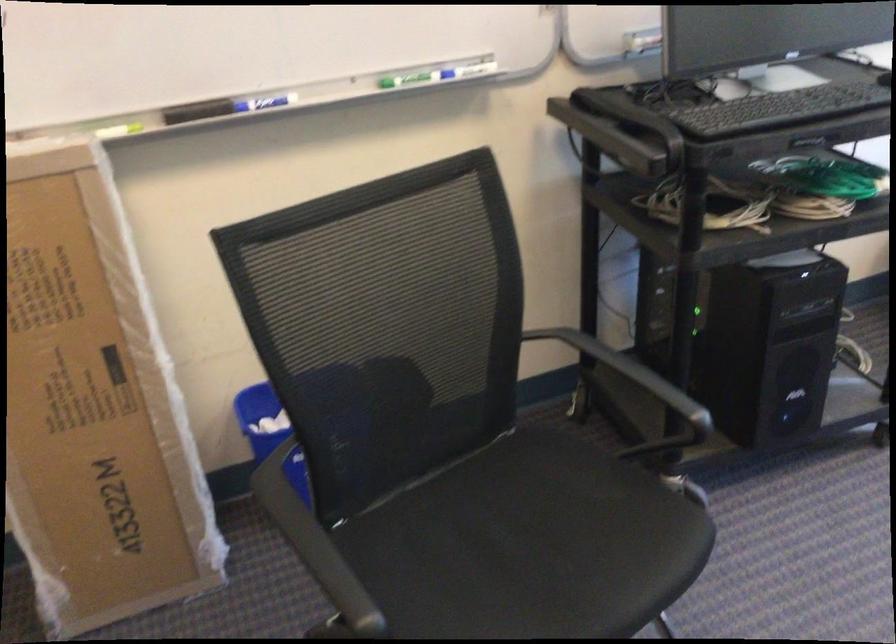
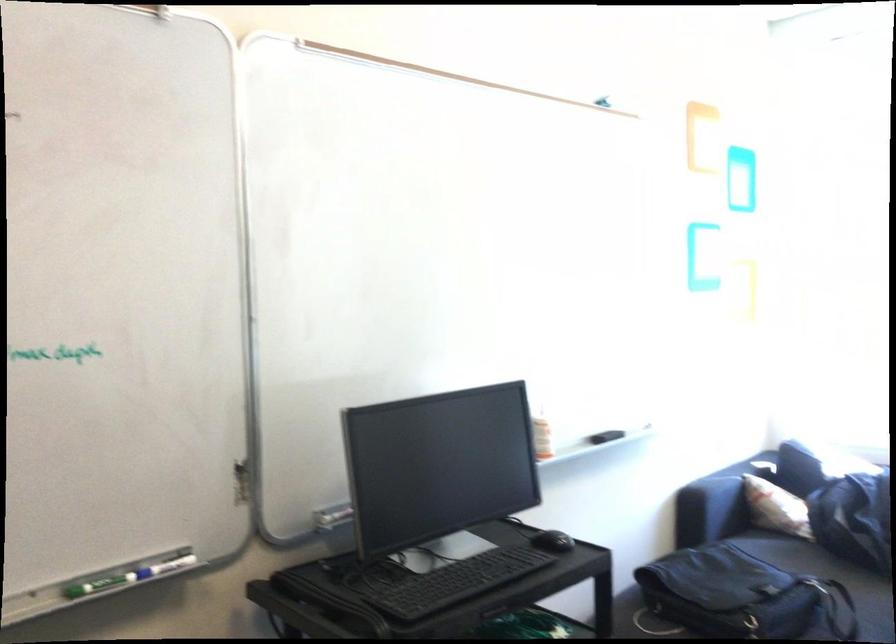
Locate, in the second image, the point that corresponds to (471,71) in the first image.

(165, 567)